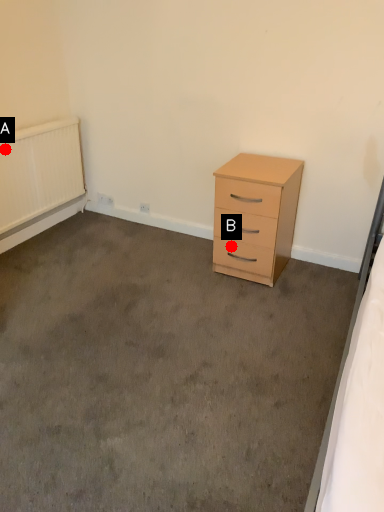
Question: Two points are circled on the image, labeled by A and B beside each circle. Which point is closer to the camera?

Choices:
 (A) A is closer
 (B) B is closer

Answer: (B)